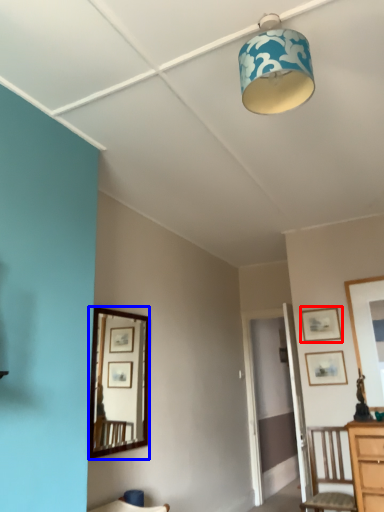
Question: Which point is further to the camera, picture frame (highlighted by a red box) or mirror (highlighted by a blue box)?

Choices:
 (A) picture frame
 (B) mirror

Answer: (A)